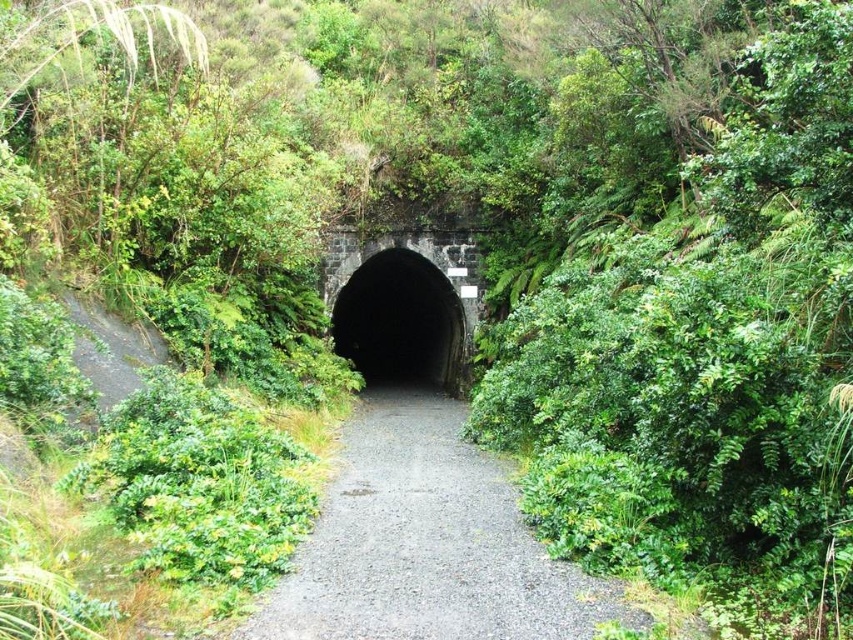
Does gray gravel path at center have a lesser width compared to black stone tunnel at center?

Indeed, gray gravel path at center has a lesser width compared to black stone tunnel at center.

Which of these two, gray gravel path at center or black stone tunnel at center, stands shorter?

gray gravel path at center

Measure the distance between point [421,566] and camera.

A distance of 12.93 meters exists between point [421,566] and camera.

Image resolution: width=853 pixels, height=640 pixels. Find the location of `gray gravel path at center`. gray gravel path at center is located at coordinates (426, 544).